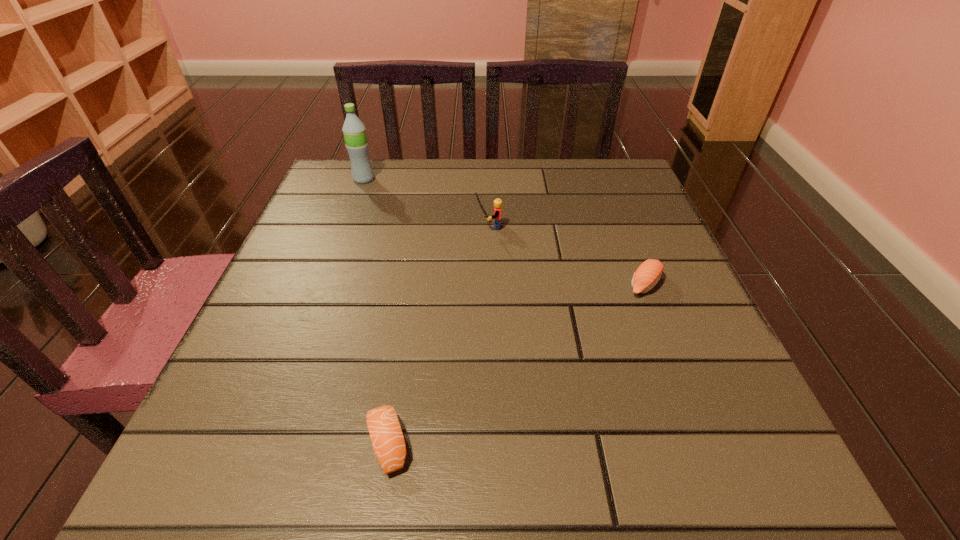
Where is `free space that satisfies the following two spatial constraints: 1. on the front-facing side of the second nearest object; 2. on the right side of the third object from left to right`? free space that satisfies the following two spatial constraints: 1. on the front-facing side of the second nearest object; 2. on the right side of the third object from left to right is located at coordinates (490, 285).